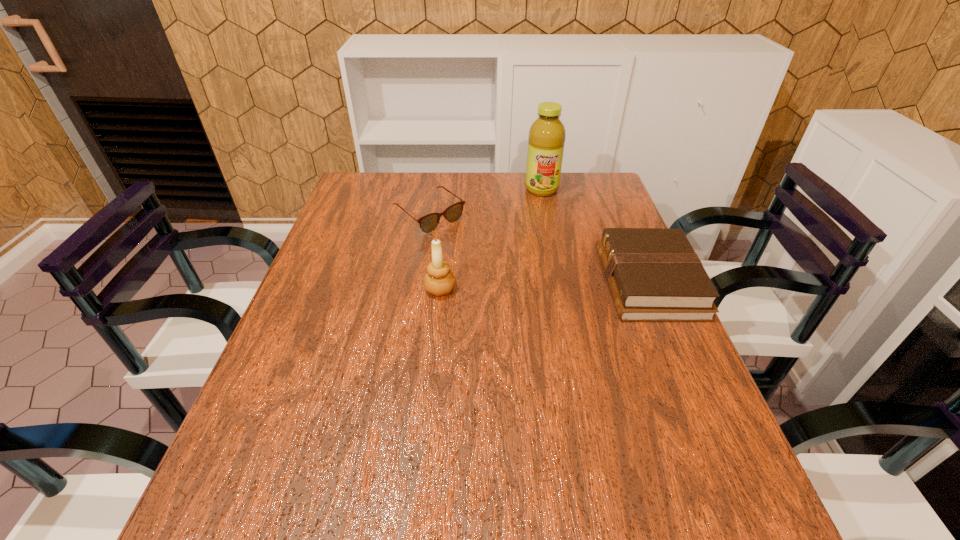
Find the location of `vacant space on the desktop that is between the candle_holder and the second shortest object and is positioned at the front view of the shortest object`. vacant space on the desktop that is between the candle_holder and the second shortest object and is positioned at the front view of the shortest object is located at coordinates (519, 286).

Locate an element on the screen. The height and width of the screenshot is (540, 960). vacant space on the desktop that is between the candle_holder and the third tallest object and is positioned on the front label of the tallest object is located at coordinates (554, 285).